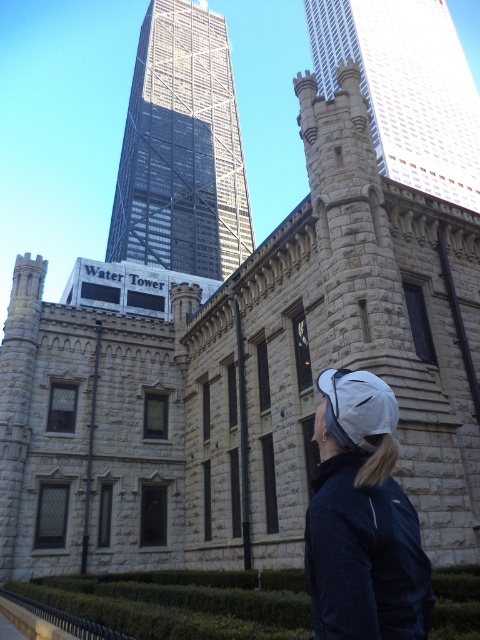
You are standing at the base of the historic Water Tower and looking up. There is a point marked at coordinates point [181,148]. Where is this point located?

The point [181,148] is on reflective glass skyscraper at upper center.

You are an architect analyzing the Chicago skyline. You notice the reflective glass skyscraper at upper center and the stone turret at upper center. Which of these two structures is located to the left when viewed from your perspective?

The reflective glass skyscraper at upper center is positioned on the left side of the stone turret at upper center, so it is located to the left when viewed from your perspective.

You are an architect analyzing the Chicago Water Tower scene. You notice the white matte cap at upper center and the stone turret at upper center. Which of these two elements takes up more visual space in the composition?

The stone turret at upper center occupies more visual space than the white matte cap at upper center, as stated in the description.